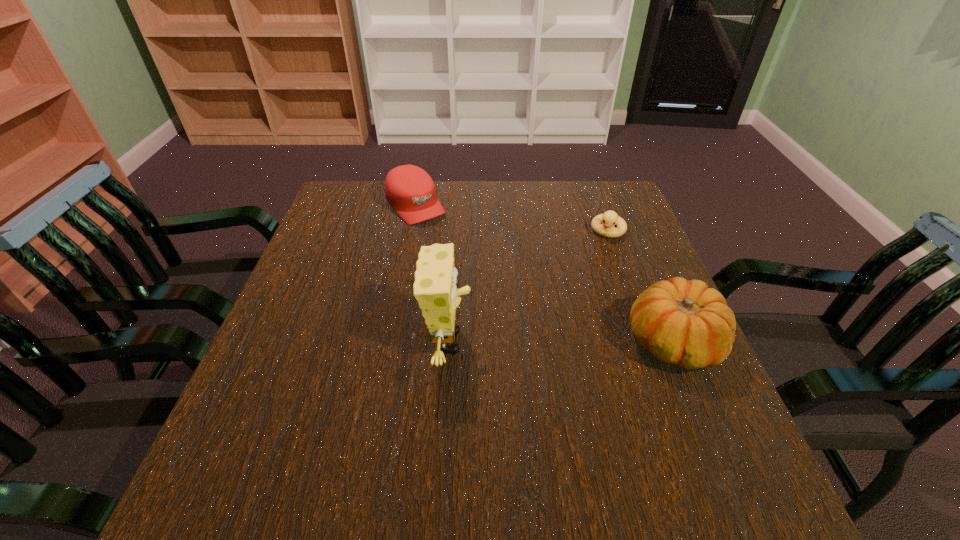
The width and height of the screenshot is (960, 540). Identify the location of sponge. (435, 290).

At what (x,y) coordinates should I click in order to perform the action: click on the second tallest object. Please return your answer as a coordinate pair (x, y). The height and width of the screenshot is (540, 960). Looking at the image, I should click on (682, 322).

This screenshot has height=540, width=960. In order to click on the shortest object in this screenshot , I will do `click(610, 218)`.

I want to click on cap, so click(410, 191).

Where is `vacant region located 0.160m on the face of the tallest object`? This screenshot has height=540, width=960. vacant region located 0.160m on the face of the tallest object is located at coordinates (547, 342).

The image size is (960, 540). What are the coordinates of `vacant space located 0.190m on the back of the second tallest object` in the screenshot? It's located at (636, 255).

I want to click on vacant area located at the beak of the duckling, so click(x=575, y=332).

Where is `vacant space situated 0.290m at the beak of the duckling`? This screenshot has width=960, height=540. vacant space situated 0.290m at the beak of the duckling is located at coordinates (582, 313).

I want to click on free space located at the beak of the duckling, so click(571, 345).

Locate an element on the screen. vacant position located 0.350m on the front-facing side of the second shortest object is located at coordinates (500, 296).